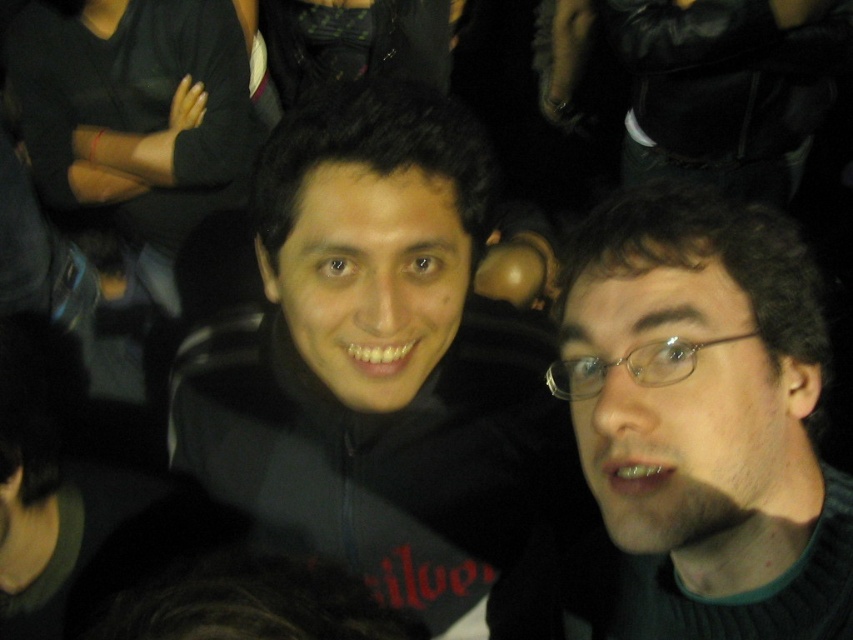
Question: Is black matte jacket at center bigger than dark brown hair at right?

Choices:
 (A) yes
 (B) no

Answer: (A)

Question: Which point appears closest to the camera in this image?

Choices:
 (A) (320, 481)
 (B) (606, 509)

Answer: (B)

Question: Among these objects, which one is farthest from the camera?

Choices:
 (A) black matte jacket at center
 (B) dark brown hair at right

Answer: (A)

Question: Does black matte jacket at center lie in front of dark brown hair at right?

Choices:
 (A) no
 (B) yes

Answer: (A)

Question: Can you confirm if black matte jacket at center is positioned to the left of dark brown hair at right?

Choices:
 (A) no
 (B) yes

Answer: (B)